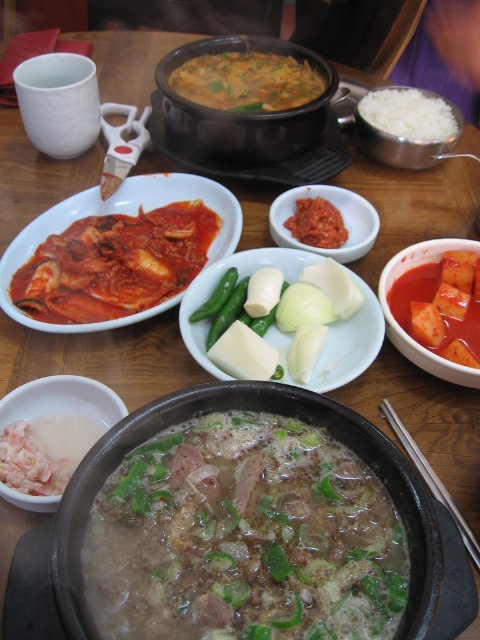
Is tomato sauce pasta at center below smooth white bowl at center?

Yes, tomato sauce pasta at center is below smooth white bowl at center.

Between point (71, 301) and point (272, 212), which one is positioned in front?

Point (71, 301) is in front.

Find the location of a particular element. Image resolution: width=480 pixels, height=640 pixels. tomato sauce pasta at center is located at coordinates (115, 262).

Between matte ceramic pot at center and smooth white bowl at center, which one has less height?

smooth white bowl at center is shorter.

Who is more forward, (328, 84) or (286, 237)?

Positioned in front is point (286, 237).

Who is more distant from viewer, [225,132] or [372,212]?

A: Point [225,132]

Identify the location of matte ceramic pot at center. The image size is (480, 640). (243, 113).

Is point (332, 556) closer to camera compared to point (312, 200)?

That is True.

Does slightly browned broth at center have a greater width compared to bright red paste at center?

Yes, slightly browned broth at center is wider than bright red paste at center.

Which is behind, point (324, 428) or point (319, 227)?

The point (319, 227) is behind.

Find the location of a particular element. slightly browned broth at center is located at coordinates (244, 536).